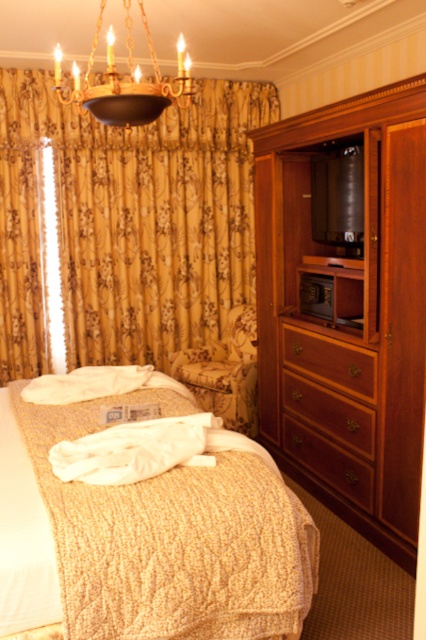
Question: Which point appears farthest from the camera in this image?

Choices:
 (A) (232, 564)
 (B) (92, 102)

Answer: (B)

Question: Observing the image, what is the correct spatial positioning of wooden dresser at right in reference to gold metallic chandelier at upper center?

Choices:
 (A) right
 (B) left

Answer: (A)

Question: Where is gold metallic chandelier at upper center located in relation to wooden drawer at right in the image?

Choices:
 (A) left
 (B) right

Answer: (A)

Question: Can you confirm if gold floral fabric curtain at upper left is thinner than wooden drawer at center?

Choices:
 (A) yes
 (B) no

Answer: (B)

Question: Which point is closer to the camera?

Choices:
 (A) coord(109,100)
 (B) coord(325,384)

Answer: (A)

Question: Which object is the closest to the gold metallic chandelier at upper center?

Choices:
 (A) wooden drawer at center
 (B) brown wood drawer at center
 (C) beige quilted bed at center

Answer: (C)